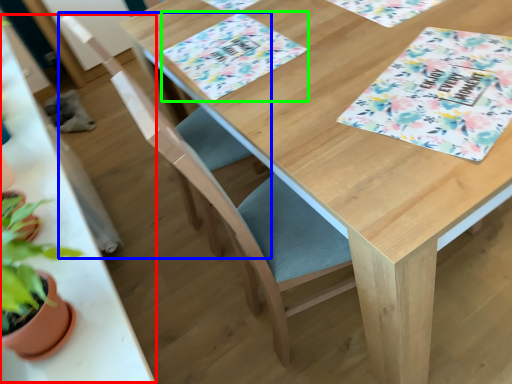
Question: Which is nearer to the round table (highlighted by a red box)? folding chair (highlighted by a blue box) or place mat (highlighted by a green box).

Choices:
 (A) folding chair
 (B) place mat

Answer: (B)